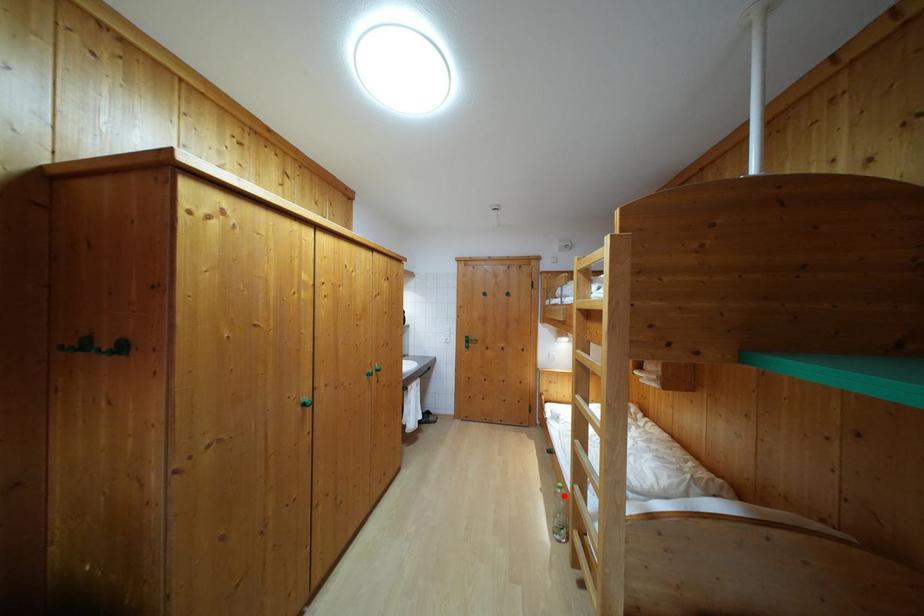
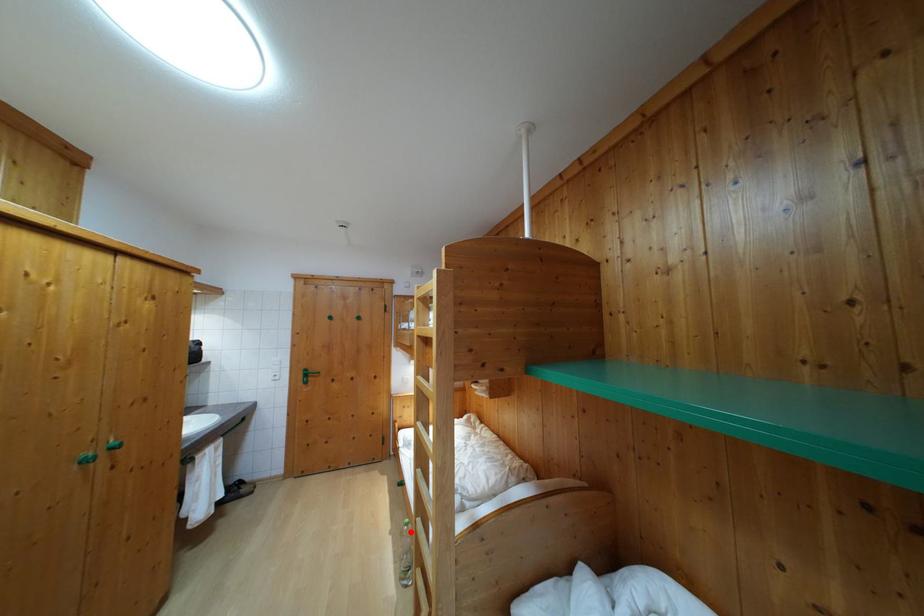
I am providing you with two images of the same scene from different viewpoints. A red point is marked on the first image and another point is marked on the second image. Are the points marked in image1 and image2 representing the same 3D position?

Yes